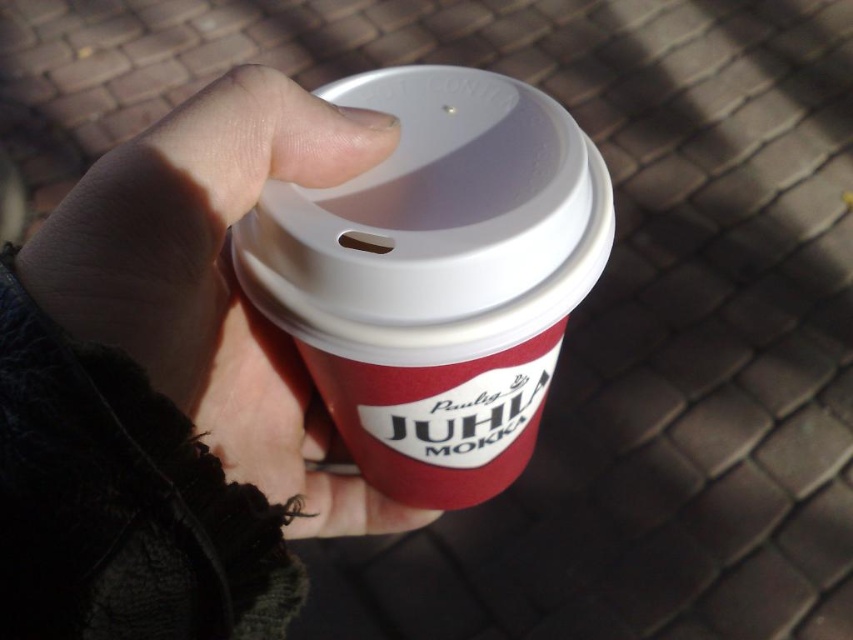
Who is more forward, (393,413) or (224,451)?

Point (393,413) is in front.

Which is behind, point (370, 257) or point (314, 176)?

The point (314, 176) is behind.

Does point (519, 112) come farther from viewer compared to point (318, 104)?

Yes.

The height and width of the screenshot is (640, 853). Find the location of `matte plastic cup at center`. matte plastic cup at center is located at coordinates (436, 276).